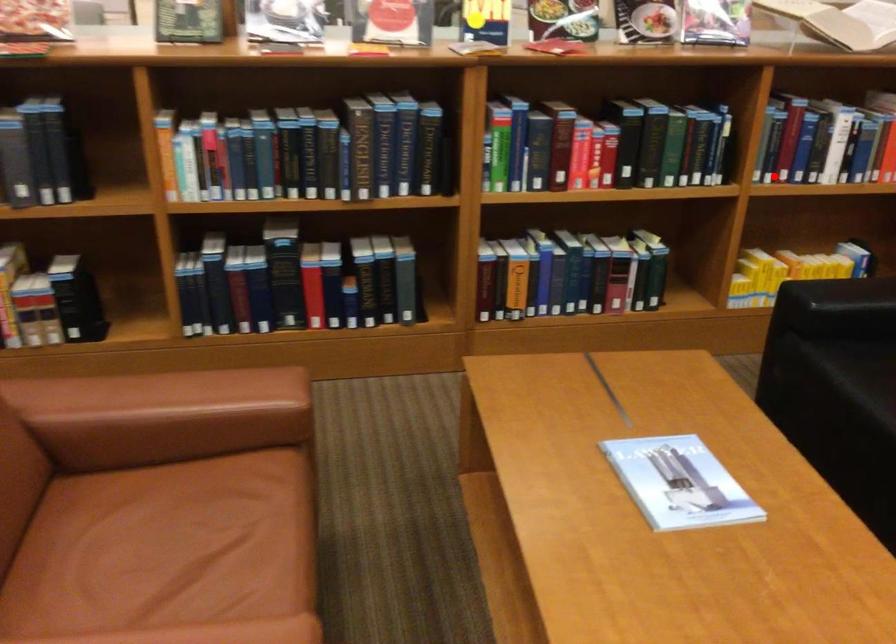
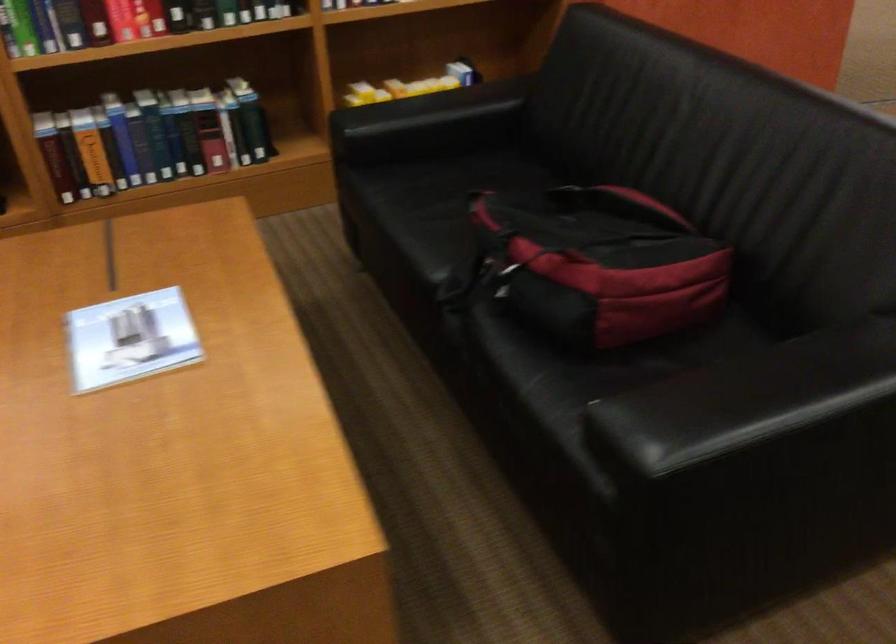
The point at the highlighted location is marked in the first image. Where is the corresponding point in the second image?

(350, 3)